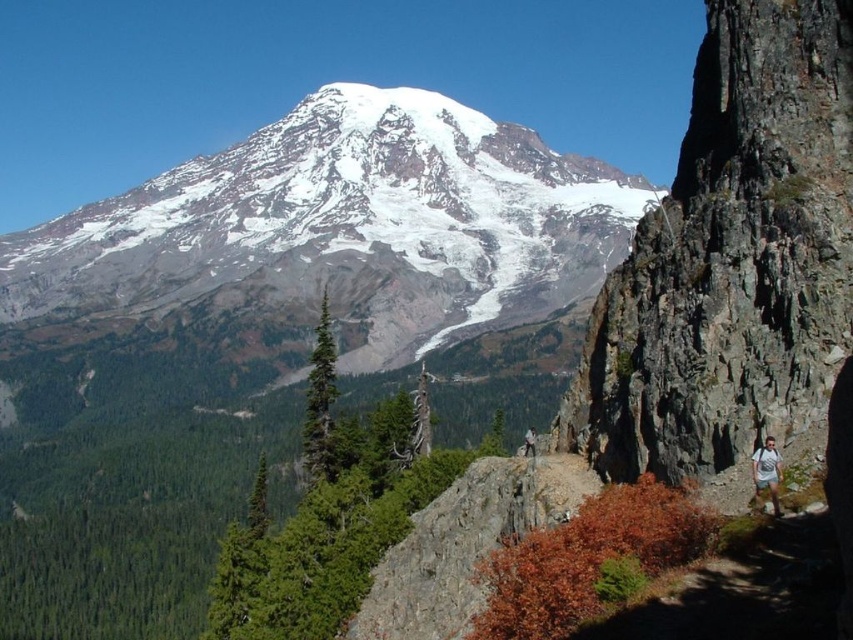
Question: Considering the real-world distances, which object is closest to the white cotton shirt at center-right?

Choices:
 (A) white snow-covered mountain at upper center
 (B) white cotton shirt at lower right

Answer: (B)

Question: Does white cotton shirt at lower right lie behind white cotton shirt at center-right?

Choices:
 (A) yes
 (B) no

Answer: (B)

Question: Does white cotton shirt at lower right have a lesser width compared to white cotton shirt at center-right?

Choices:
 (A) yes
 (B) no

Answer: (A)

Question: Which point is farther to the camera?

Choices:
 (A) (527, 442)
 (B) (772, 452)
 (C) (514, 266)

Answer: (C)

Question: Which point is closer to the camera taking this photo?

Choices:
 (A) (170, 330)
 (B) (757, 499)

Answer: (B)

Question: Is white snow-covered mountain at upper center positioned behind white cotton shirt at lower right?

Choices:
 (A) yes
 (B) no

Answer: (A)